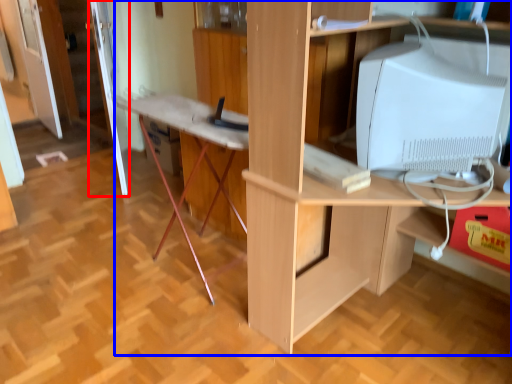
Question: Which of the following is the closest to the observer, door (highlighted by a red box) or desk (highlighted by a blue box)?

Choices:
 (A) door
 (B) desk

Answer: (B)